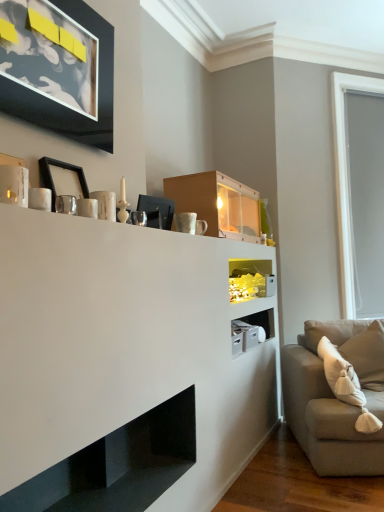
Question: Considering the relative sizes of translucent glass shelf at center, acting as the 2th shelf starting from the bottom, and matte wood cabinet at upper center in the image provided, is translucent glass shelf at center, acting as the 2th shelf starting from the bottom, thinner than matte wood cabinet at upper center?

Choices:
 (A) yes
 (B) no

Answer: (A)

Question: Does translucent glass shelf at center, marked as the 1th shelf in a right-to-left arrangement, have a lesser height compared to matte wood cabinet at upper center?

Choices:
 (A) yes
 (B) no

Answer: (A)

Question: From a real-world perspective, does translucent glass shelf at center, positioned as the 1th shelf in back-to-front order, stand above matte wood cabinet at upper center?

Choices:
 (A) no
 (B) yes

Answer: (A)

Question: Is translucent glass shelf at center, which appears as the 1th shelf when viewed from the top, to the left of matte wood cabinet at upper center from the viewer's perspective?

Choices:
 (A) no
 (B) yes

Answer: (A)

Question: From the image's perspective, is translucent glass shelf at center, acting as the 2th shelf starting from the bottom, over matte wood cabinet at upper center?

Choices:
 (A) no
 (B) yes

Answer: (A)

Question: Is there a large distance between translucent glass shelf at center, which is the second shelf in left-to-right order, and matte wood cabinet at upper center?

Choices:
 (A) no
 (B) yes

Answer: (A)

Question: Can you confirm if black matte picture frame at upper left, which is counted as the 1th picture frame, starting from the top, is smaller than black glossy shelf at lower center, the first shelf from the front?

Choices:
 (A) yes
 (B) no

Answer: (A)

Question: Is black matte picture frame at upper left, which is counted as the 1th picture frame, starting from the top, at the left side of black glossy shelf at lower center, the second shelf when ordered from right to left?

Choices:
 (A) no
 (B) yes

Answer: (B)

Question: Is black matte picture frame at upper left, which is counted as the 1th picture frame, starting from the top, in contact with black glossy shelf at lower center, which appears as the 2th shelf when viewed from the top?

Choices:
 (A) no
 (B) yes

Answer: (A)

Question: Can you confirm if black matte picture frame at upper left, which is counted as the 1th picture frame, starting from the top, is positioned to the right of black glossy shelf at lower center, the first shelf from the front?

Choices:
 (A) no
 (B) yes

Answer: (A)

Question: From the image's perspective, is black matte picture frame at upper left, the second picture frame from the bottom, beneath black glossy shelf at lower center, the first shelf when ordered from left to right?

Choices:
 (A) no
 (B) yes

Answer: (A)

Question: Can you confirm if black matte picture frame at upper left, the second picture frame from the bottom, is wider than black glossy shelf at lower center, which appears as the 2th shelf when viewed from the top?

Choices:
 (A) yes
 (B) no

Answer: (B)

Question: Considering the relative sizes of beige soft cushion at right and gray matte window screen at right in the image provided, is beige soft cushion at right shorter than gray matte window screen at right?

Choices:
 (A) no
 (B) yes

Answer: (B)